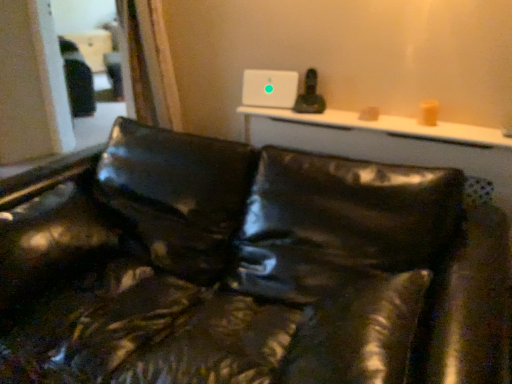
Question: Is matte black couch at center to the right of white glossy table at upper center from the viewer's perspective?

Choices:
 (A) yes
 (B) no

Answer: (B)

Question: Is matte black couch at center shorter than white glossy table at upper center?

Choices:
 (A) no
 (B) yes

Answer: (A)

Question: Is matte black couch at center with white glossy table at upper center?

Choices:
 (A) no
 (B) yes

Answer: (A)

Question: From a real-world perspective, is matte black couch at center over white glossy table at upper center?

Choices:
 (A) no
 (B) yes

Answer: (A)

Question: Is matte black couch at center bigger than white glossy table at upper center?

Choices:
 (A) no
 (B) yes

Answer: (B)

Question: Does matte black couch at center have a greater height compared to white glossy table at upper center?

Choices:
 (A) yes
 (B) no

Answer: (A)

Question: Can you confirm if white glossy table at upper center is bigger than matte black couch at center?

Choices:
 (A) no
 (B) yes

Answer: (A)

Question: Is matte black couch at center completely or partially inside white glossy table at upper center?

Choices:
 (A) yes
 (B) no

Answer: (B)

Question: Are white glossy table at upper center and matte black couch at center beside each other?

Choices:
 (A) no
 (B) yes

Answer: (A)

Question: Are white glossy table at upper center and matte black couch at center located far from each other?

Choices:
 (A) yes
 (B) no

Answer: (B)

Question: Could you tell me if white glossy table at upper center is turned towards matte black couch at center?

Choices:
 (A) no
 (B) yes

Answer: (A)

Question: Is white glossy table at upper center not inside matte black couch at center?

Choices:
 (A) no
 (B) yes

Answer: (B)

Question: Choose the correct answer: Is white glossy table at upper center inside matte black couch at center or outside it?

Choices:
 (A) outside
 (B) inside

Answer: (A)